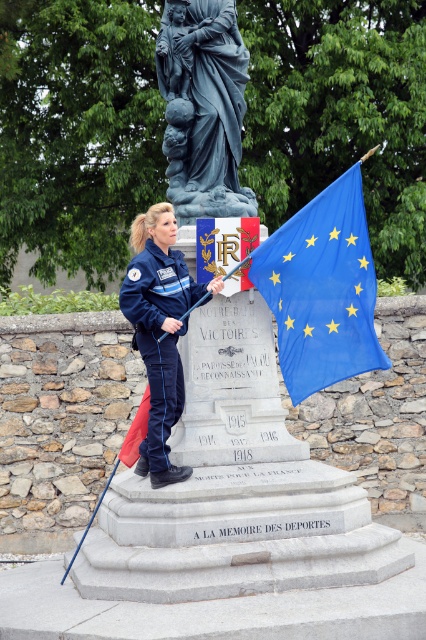
Question: Among these points, which one is farthest from the camera?

Choices:
 (A) click(x=135, y=308)
 (B) click(x=169, y=124)
 (C) click(x=290, y=317)

Answer: (B)

Question: Can you confirm if blue fabric flag at right is positioned below navy blue fabric uniform at center?

Choices:
 (A) yes
 (B) no

Answer: (B)

Question: Among these objects, which one is farthest from the camera?

Choices:
 (A) blue stone statue at upper center
 (B) blue fabric flag at right
 (C) navy blue fabric uniform at center

Answer: (A)

Question: Does blue stone statue at upper center have a smaller size compared to navy blue fabric uniform at center?

Choices:
 (A) no
 (B) yes

Answer: (A)

Question: Does blue fabric flag at right have a larger size compared to navy blue fabric uniform at center?

Choices:
 (A) no
 (B) yes

Answer: (A)

Question: Which of these objects is positioned closest to the blue fabric flag at right?

Choices:
 (A) blue stone statue at upper center
 (B) navy blue fabric uniform at center

Answer: (B)